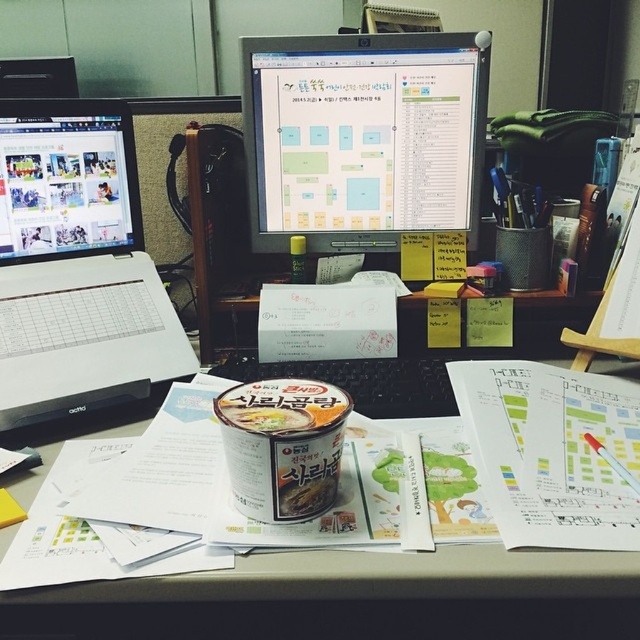
You are organizing the items on the desk and want to place the white plastic laptop at left and the matte plastic cup at center into a storage box. The box can only accommodate items that are narrower than 30 cm. Based on the scene, can both items fit inside the box?

The white plastic laptop at left might be wider than matte plastic cup at center. However, since the exact width isn t provided, we can t confirm if both fit in the 30 cm box. More information is needed.

You are a student trying to locate your laptop in the image. The desk has a cup of instant noodles in the foreground. Where is the white plastic laptop at left relative to the cup of instant noodles?

The white plastic laptop at left is located at the coordinates [76,266] in the image, which is to the left of the cup of instant noodles in the foreground.

You need to place both the matte black laptop at left and the matte plastic cup at center into a box that can only hold items up to the size of the laptop. Which item will definitely fit inside the box?

The matte plastic cup at center will definitely fit inside the box because its width is smaller than the matte black laptop at left, which is the maximum size the box can hold.